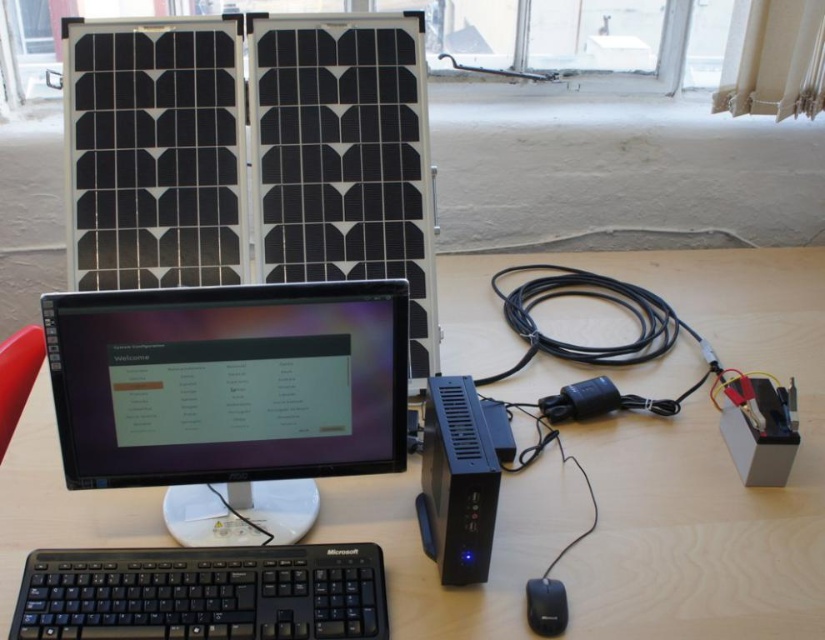
Question: Which object is positioned farthest from the black plastic keyboard at lower left?

Choices:
 (A) wooden at center
 (B) black plastic mouse at lower right
 (C) black plastic solar battery at center
 (D) black glossy monitor at center

Answer: (B)

Question: Is black glossy monitor at center smaller than black plastic mouse at lower right?

Choices:
 (A) yes
 (B) no

Answer: (B)

Question: Which object appears farthest from the camera in this image?

Choices:
 (A) black glossy monitor at center
 (B) black plastic mouse at lower right
 (C) black plastic solar battery at center
 (D) wooden at center

Answer: (D)

Question: Observing the image, what is the correct spatial positioning of black plastic keyboard at lower left in reference to black plastic mouse at lower right?

Choices:
 (A) left
 (B) right

Answer: (A)

Question: Which point appears farthest from the camera in this image?

Choices:
 (A) (106, 365)
 (B) (561, 611)
 (C) (356, 595)

Answer: (C)

Question: Does black plastic solar battery at center appear under black plastic mouse at lower right?

Choices:
 (A) yes
 (B) no

Answer: (B)